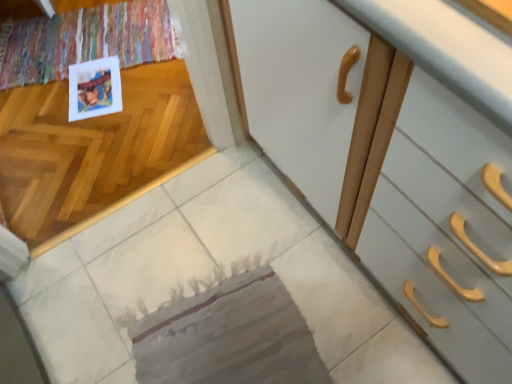
Question: From a real-world perspective, relative to matte paper postcard at upper left, is textured gray mat at center vertically above or below?

Choices:
 (A) above
 (B) below

Answer: (A)

Question: Relative to matte paper postcard at upper left, is textured gray mat at center in front or behind?

Choices:
 (A) front
 (B) behind

Answer: (A)

Question: From the image's perspective, is textured gray mat at center above or below matte paper postcard at upper left?

Choices:
 (A) below
 (B) above

Answer: (A)

Question: Looking at the image, does matte paper postcard at upper left seem bigger or smaller compared to textured gray mat at center?

Choices:
 (A) small
 (B) big

Answer: (A)

Question: Relative to textured gray mat at center, is matte paper postcard at upper left in front or behind?

Choices:
 (A) front
 (B) behind

Answer: (B)

Question: Do you think matte paper postcard at upper left is within textured gray mat at center, or outside of it?

Choices:
 (A) inside
 (B) outside

Answer: (B)

Question: Does point (84, 82) appear closer or farther from the camera than point (193, 377)?

Choices:
 (A) farther
 (B) closer

Answer: (A)